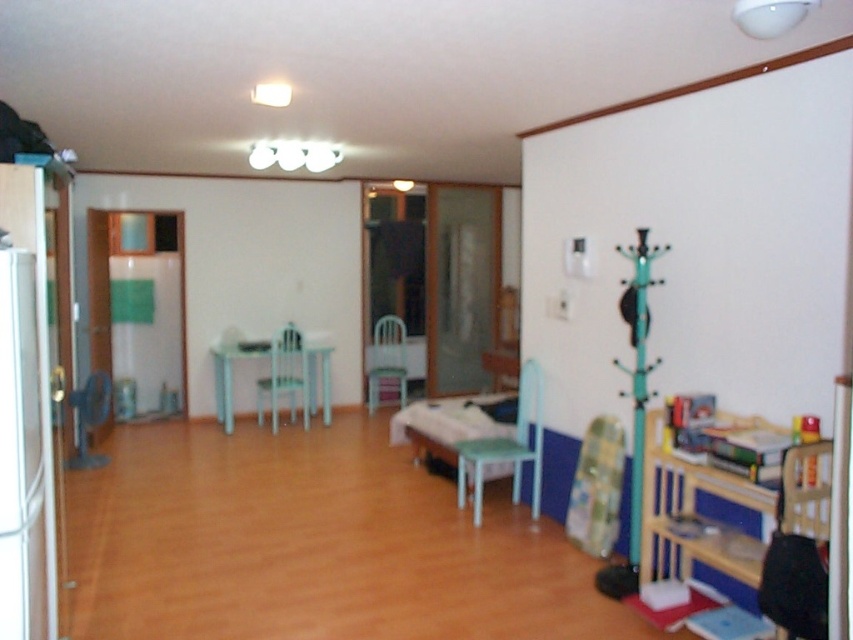
You are standing in the center of the room and want to move towards the two points marked on the floor. Which point, point 1 at coordinates [672,563] or point 2 at coordinates [480,506], is closer to you?

Point 1 at coordinates [672,563] is closer to you than point 2 at coordinates [480,506].

You are planning to place a new plant pot between the wooden bookshelf at right and the light blue plastic chair at center. Based on their heights, which object should the plant pot be placed closer to?

The wooden bookshelf at right is shorter than the light blue plastic chair at center, so the plant pot should be placed closer to the wooden bookshelf at right to maintain visual balance.